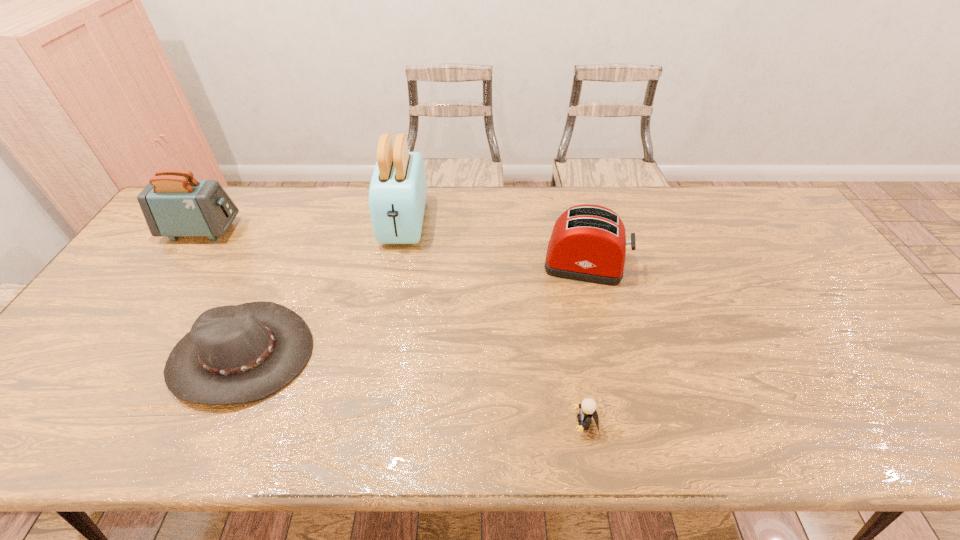
This screenshot has height=540, width=960. In order to click on vacant region that satisfies the following two spatial constraints: 1. on the front-facing side of the shortest toaster; 2. on the right side of the fourth shortest object in this screenshot , I will do `click(179, 264)`.

This screenshot has width=960, height=540. Identify the location of free space that satisfies the following two spatial constraints: 1. on the side of the shortest toaster with the lever; 2. on the left side of the tallest object. (396, 264).